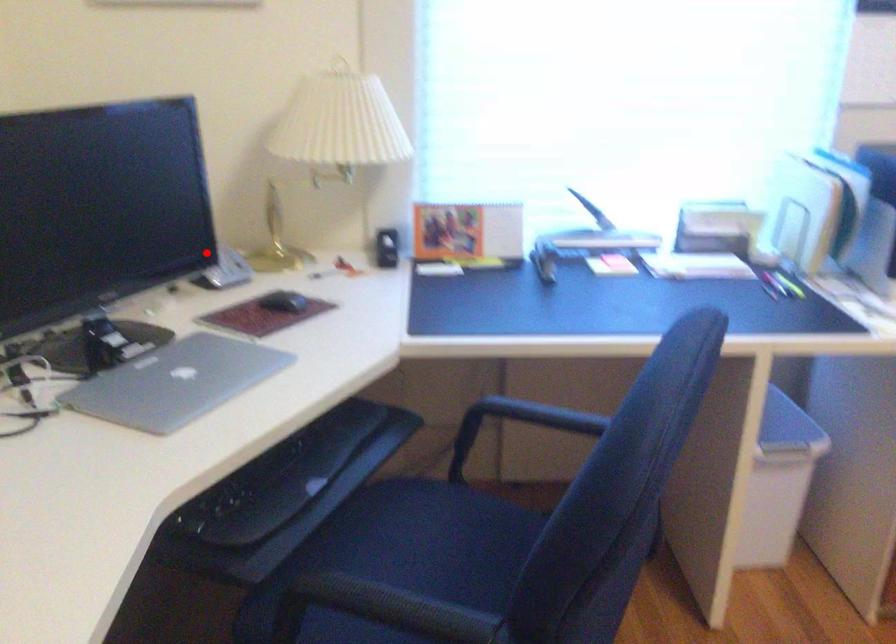
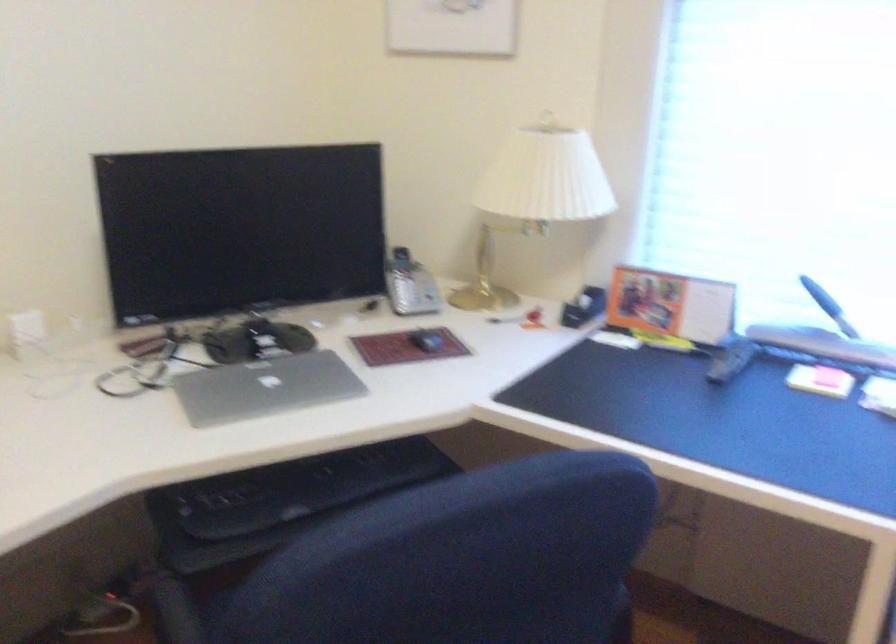
Question: A red point is marked in image1. In image2, is the corresponding 3D point closer to the camera or farther? Reply with the corresponding letter.

Choices:
 (A) The corresponding 3D point is closer.
 (B) The corresponding 3D point is farther.

Answer: (B)